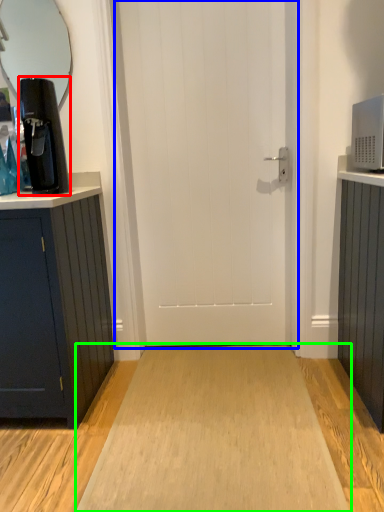
Question: Which is farther away from coffee machine (highlighted by a red box)? door (highlighted by a blue box) or plain (highlighted by a green box)?

Choices:
 (A) door
 (B) plain

Answer: (B)